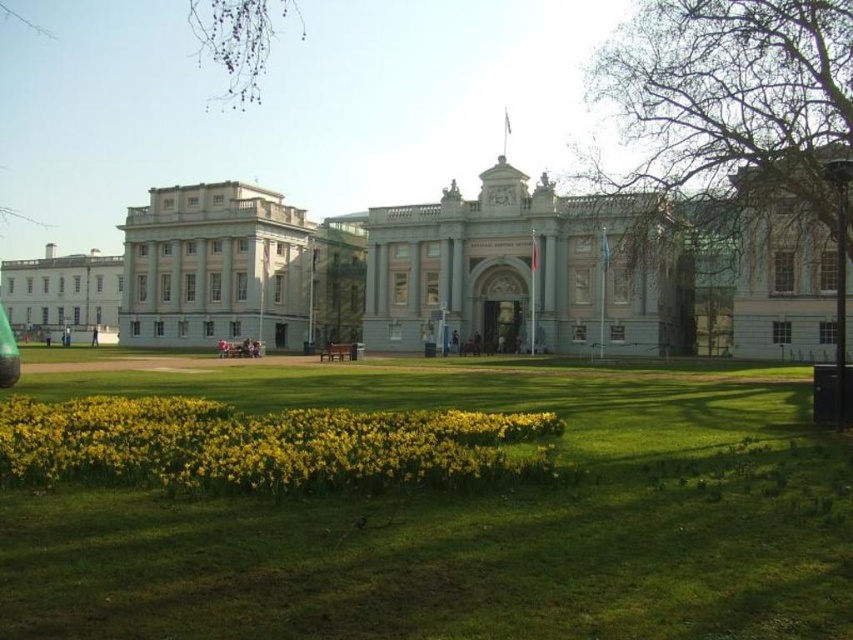
Which of these two, green grass at lower center or yellow matte flowers at lower center, stands shorter?

yellow matte flowers at lower center is shorter.

The image size is (853, 640). What do you see at coordinates (461, 515) in the screenshot?
I see `green grass at lower center` at bounding box center [461, 515].

Where is `green grass at lower center`? Image resolution: width=853 pixels, height=640 pixels. green grass at lower center is located at coordinates (461, 515).

The height and width of the screenshot is (640, 853). In order to click on green grass at lower center in this screenshot , I will do `click(461, 515)`.

Who is shorter, smooth gray building at center or yellow matte flowers at lower center?

yellow matte flowers at lower center

Does point (379, 333) come closer to viewer compared to point (125, 397)?

No, it is not.

This screenshot has height=640, width=853. What are the coordinates of `smooth gray building at center` in the screenshot? It's located at (448, 275).

Does green grass at lower center have a smaller size compared to smooth gray building at center?

Yes.

What are the coordinates of `green grass at lower center` in the screenshot? It's located at (461, 515).

At what (x,y) coordinates should I click in order to perform the action: click on green grass at lower center. Please return your answer as a coordinate pair (x, y). Image resolution: width=853 pixels, height=640 pixels. Looking at the image, I should click on (461, 515).